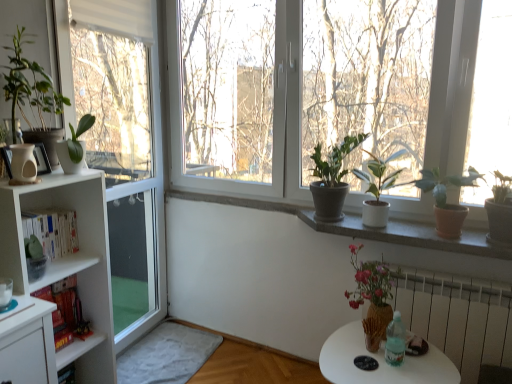
Question: From a real-world perspective, is green matte plant at left, marked as the 4th houseplant in a right-to-left arrangement, above or below green matte plant at center, the 3th houseplant from the right?

Choices:
 (A) below
 (B) above

Answer: (B)

Question: Considering their positions, is green matte plant at left, marked as the 4th houseplant in a right-to-left arrangement, located in front of or behind green matte plant at center, the 3th houseplant from the right?

Choices:
 (A) behind
 (B) front

Answer: (B)

Question: Estimate the real-world distances between objects in this image. Which object is farther from the green matte plant at left, marked as the 4th houseplant in a right-to-left arrangement?

Choices:
 (A) white radiator at lower right
 (B) green matte plant at center, the fifth houseplant viewed from the left
 (C) green matte plant at left, positioned as the 5th houseplant in right-to-left order
 (D) green matte plant at upper left, which appears as the first houseplant when viewed from the left
 (E) white plastic window frame at left

Answer: (A)

Question: Which of these objects is positioned farthest from the green matte plant at center, the 3th houseplant from the right?

Choices:
 (A) white radiator at lower right
 (B) hardcover books at left
 (C) matte brown vase with flowers at lower right
 (D) matte white vase at left
 (E) green matte plant at upper right, which is the first houseplant from right to left

Answer: (D)